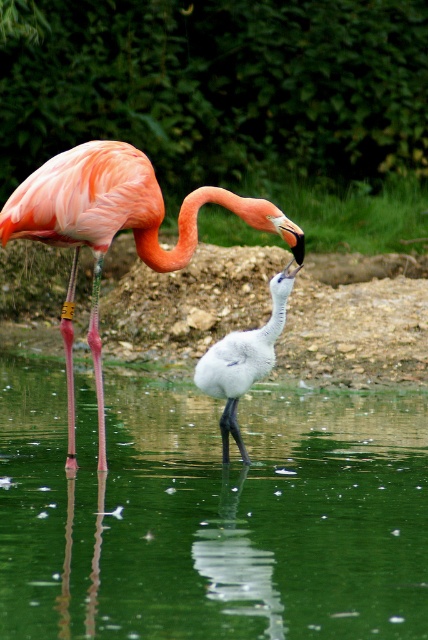
You are a photographer standing at the edge of the water. You want to take a photo of the green reflective water at center without getting your feet wet. What is the minimum distance you should keep from the water to stay dry?

The green reflective water at center is 3.14 meters from the camera. To avoid getting your feet wet, you should stay at least 3.14 meters away from the water.

You are a photographer trying to capture the white feathered bird at center. You notice the green reflective water at center is in the way. Can you adjust your position to focus on the bird without the water obstructing the view?

The green reflective water at center is closer to the viewer than the white feathered bird at center. To focus on the bird without the water obstructing the view, you should move your position to either side so that the bird is no longer behind the water.